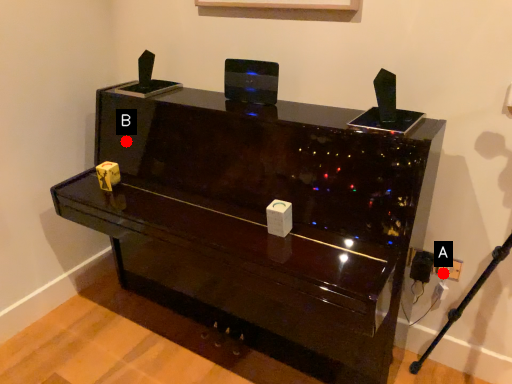
Question: Two points are circled on the image, labeled by A and B beside each circle. Which point is closer to the camera?

Choices:
 (A) A is closer
 (B) B is closer

Answer: (A)